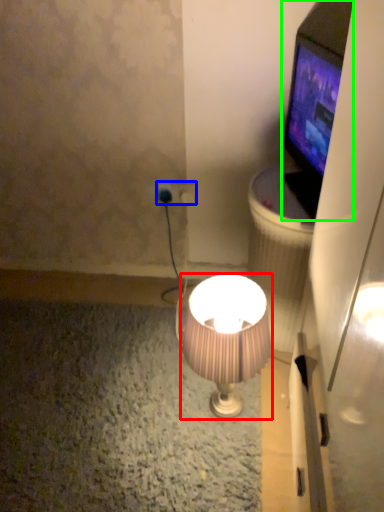
Question: Estimate the real-world distances between objects in this image. Which object is farther from lamp (highlighted by a red box), power plugs and sockets (highlighted by a blue box) or television (highlighted by a green box)?

Choices:
 (A) power plugs and sockets
 (B) television

Answer: (A)